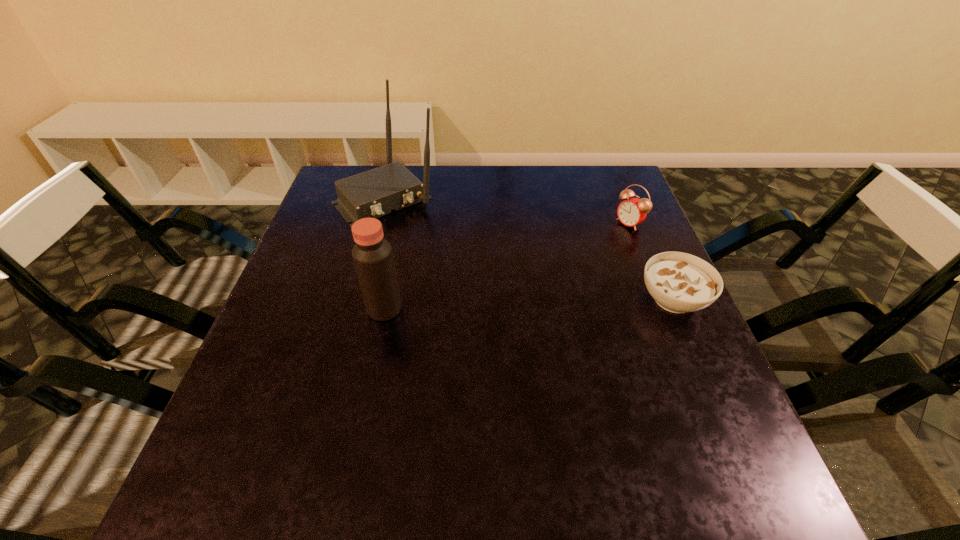
You are a GUI agent. You are given a task and a screenshot of the screen. Output one action in this format:
    pyautogui.click(x=<x>, y=<y>)
    Task: Click on the third shortest object
    
    Given the screenshot: What is the action you would take?
    pyautogui.click(x=373, y=258)

The width and height of the screenshot is (960, 540). I want to click on soup bowl, so click(679, 282).

In order to click on the second shortest object in this screenshot , I will do tap(633, 211).

Image resolution: width=960 pixels, height=540 pixels. What are the coordinates of `router` in the screenshot? It's located at (374, 193).

Where is `vacant area situated 0.360m on the back of the vinegar`? The height and width of the screenshot is (540, 960). vacant area situated 0.360m on the back of the vinegar is located at coordinates (406, 204).

Locate an element on the screen. vacant space located on the left of the shortest object is located at coordinates (565, 299).

Identify the location of free space located on the clock face of the alarm clock. The height and width of the screenshot is (540, 960). (609, 236).

Identify the location of vacant space located 0.050m on the clock face of the alarm clock. This screenshot has height=540, width=960. coord(609,236).

Where is `free spot located on the clock face of the alarm clock`? The image size is (960, 540). free spot located on the clock face of the alarm clock is located at coordinates (556, 267).

The image size is (960, 540). I want to click on blank area located on the back of the tallest object to connect cables, so click(x=420, y=232).